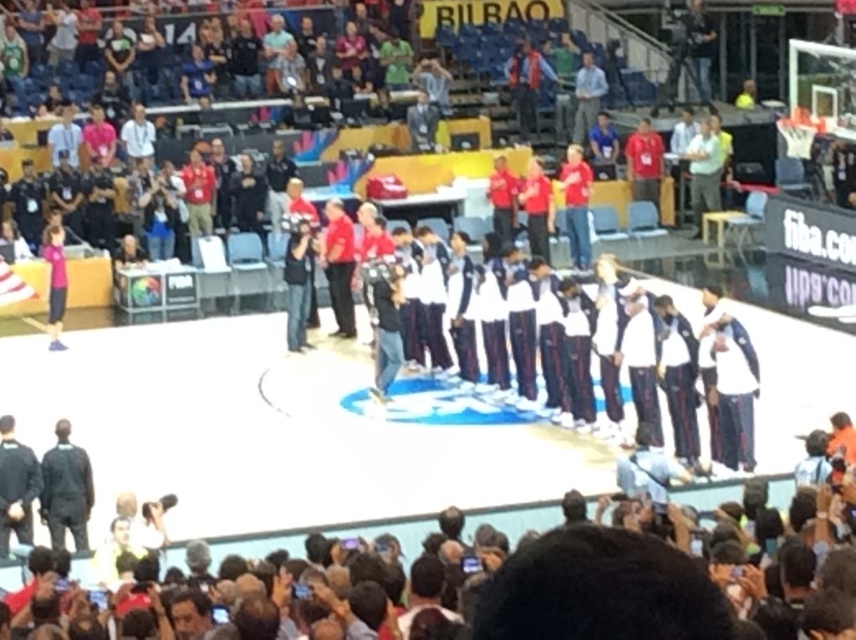
Question: Can you confirm if white fabric basketball team at center is positioned above dark gray suit at left?

Choices:
 (A) no
 (B) yes

Answer: (B)

Question: Which point is closer to the camera?

Choices:
 (A) dark gray suit at left
 (B) white fabric basketball team at center

Answer: (A)

Question: Does white fabric basketball team at center have a lesser width compared to dark gray suit at left?

Choices:
 (A) yes
 (B) no

Answer: (A)

Question: Can you confirm if white fabric basketball team at center is positioned below dark gray suit at left?

Choices:
 (A) yes
 (B) no

Answer: (B)